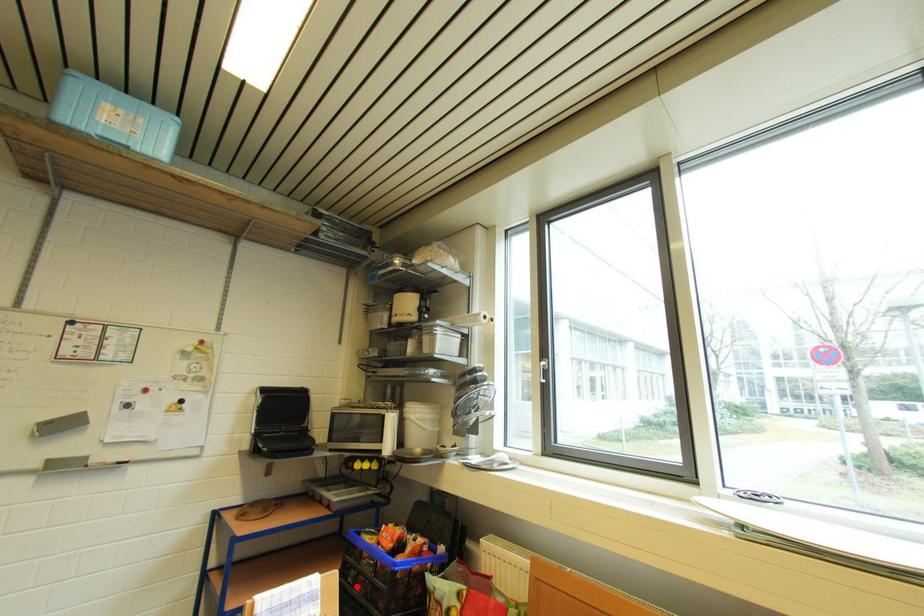
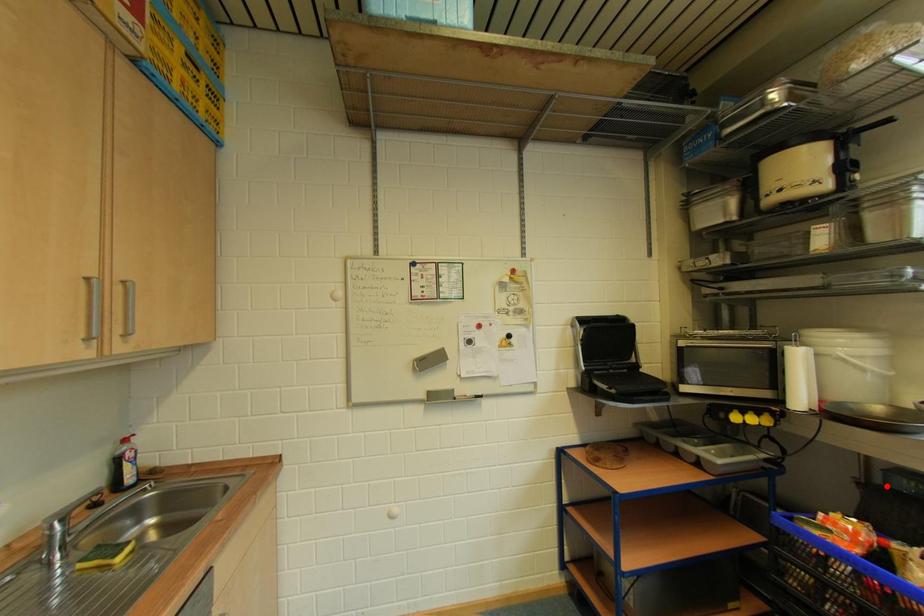
I am providing you with two images of the same scene from different viewpoints. A red point is marked on the first image and another point is marked on the second image. Is the marked point in image1 the same physical position as the marked point in image2?

No